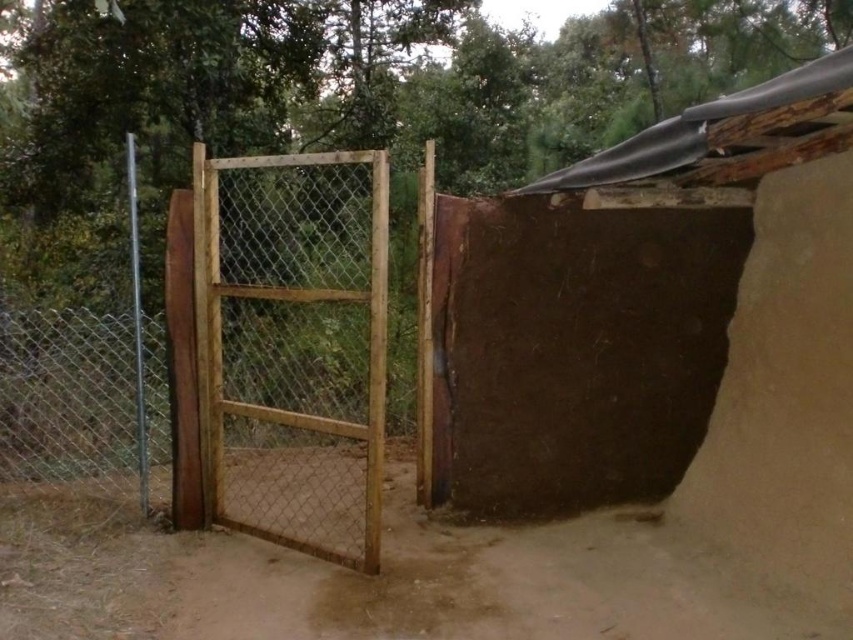
Can you confirm if wooden gate at left is shorter than wooden mesh gate at center?

No.

Which is in front, point (374, 392) or point (202, 356)?

Point (374, 392) is in front.

Which is in front, point (335, 349) or point (378, 426)?

Point (378, 426) is in front.

Where is `wooden gate at left`? wooden gate at left is located at coordinates (238, 365).

Describe the element at coordinates (238, 365) in the screenshot. I see `wooden gate at left` at that location.

Is wooden gate at left to the right of brown sandy dirt track at center from the viewer's perspective?

No, wooden gate at left is not to the right of brown sandy dirt track at center.

Who is more forward, (x=407, y=378) or (x=648, y=520)?

Point (x=648, y=520) is more forward.

Where is `wooden gate at left`? wooden gate at left is located at coordinates (238, 365).

Can you confirm if brown sandy dirt track at center is positioned below wooden mesh gate at center?

Indeed, brown sandy dirt track at center is positioned under wooden mesh gate at center.

Does brown sandy dirt track at center appear over wooden mesh gate at center?

No, brown sandy dirt track at center is not above wooden mesh gate at center.

Image resolution: width=853 pixels, height=640 pixels. I want to click on brown sandy dirt track at center, so click(x=376, y=579).